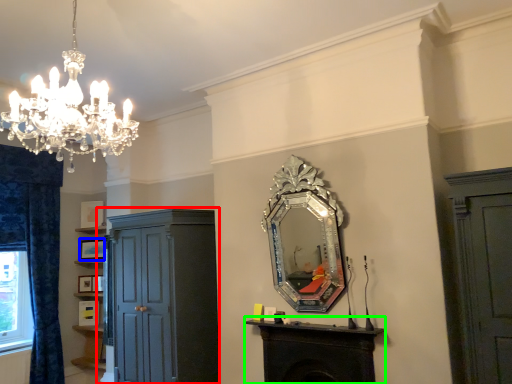
Question: Which is nearer to the cupboard (highlighted by a red box)? picture frame (highlighted by a blue box) or table (highlighted by a green box).

Choices:
 (A) picture frame
 (B) table

Answer: (B)